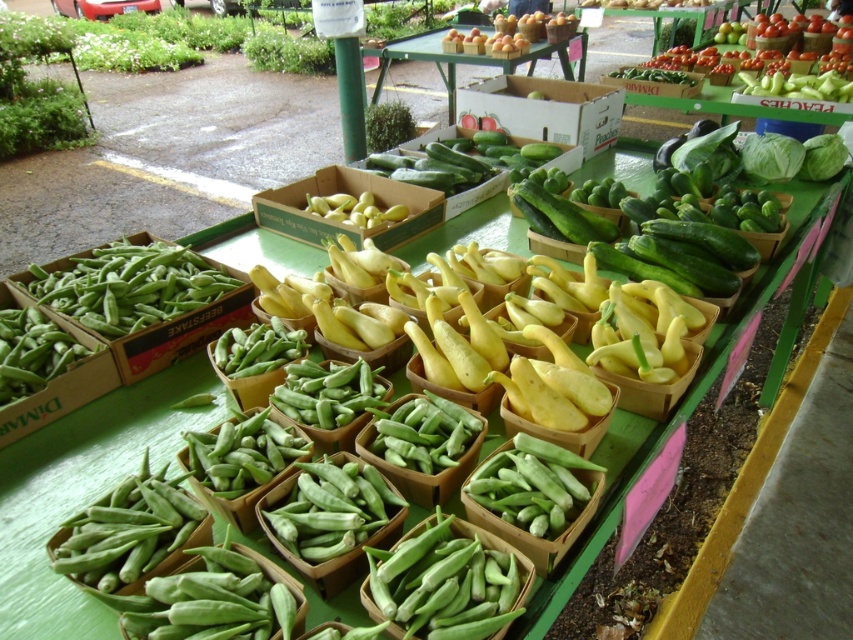
Question: Based on their relative distances, which object is farther from the green matte okra at center?

Choices:
 (A) green cardboard boxes at upper center
 (B) white cardboard box at center

Answer: (A)

Question: From the image, what is the correct spatial relationship of green matte okra at left in relation to green cardboard boxes at upper center?

Choices:
 (A) above
 (B) below

Answer: (B)

Question: Can you confirm if green matte okra at left is wider than white cardboard box at center?

Choices:
 (A) yes
 (B) no

Answer: (B)

Question: Which point is closer to the camera?

Choices:
 (A) green cardboard boxes at upper center
 (B) green matte okra at center
 (C) white cardboard box at center
 (D) green matte okra at left

Answer: (B)

Question: Is green matte okra at center further to camera compared to green matte okra at left?

Choices:
 (A) no
 (B) yes

Answer: (A)

Question: Among these objects, which one is nearest to the camera?

Choices:
 (A) green matte okra at center
 (B) green matte okra at left
 (C) white cardboard box at center
 (D) green cardboard boxes at upper center

Answer: (A)